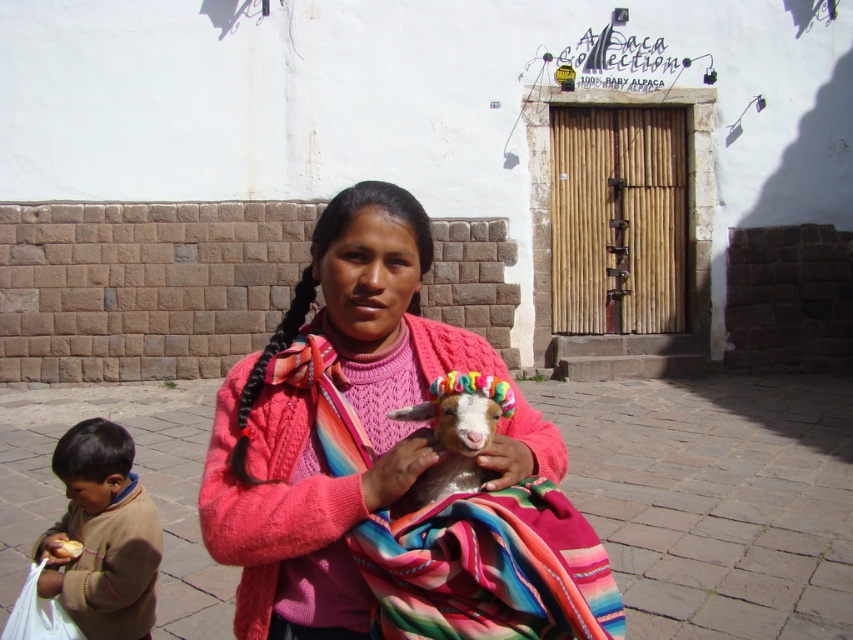
Question: Is pink knitted sweater at center above white woolen goat at center?

Choices:
 (A) yes
 (B) no

Answer: (B)

Question: Which point is farther to the camera?

Choices:
 (A) black silky pigtail at center
 (B) white woolen goat at center
 (C) pink knitted sweater at center
 (D) multicolored woven blanket at center

Answer: (A)

Question: Does pink knitted sweater at center have a larger size compared to brown wool sweater at lower left?

Choices:
 (A) no
 (B) yes

Answer: (B)

Question: Can you confirm if multicolored woven blanket at center is positioned to the left of black silky pigtail at center?

Choices:
 (A) yes
 (B) no

Answer: (B)

Question: Which point is closer to the camera taking this photo?

Choices:
 (A) (456, 492)
 (B) (236, 419)
 (C) (604, 554)
 (D) (285, 600)

Answer: (C)

Question: Which point is farther to the camera?

Choices:
 (A) (236, 436)
 (B) (563, 512)
 (C) (502, 396)
 (D) (241, 461)

Answer: (A)